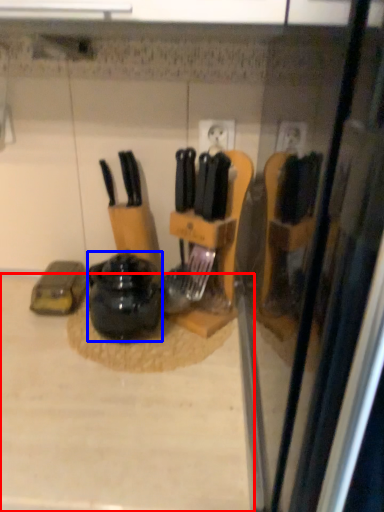
Question: Among these objects, which one is nearest to the camera, counter top (highlighted by a red box) or kitchen appliance (highlighted by a blue box)?

Choices:
 (A) counter top
 (B) kitchen appliance

Answer: (A)